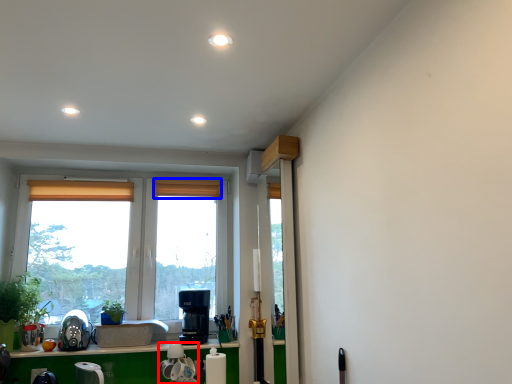
Question: Which point is closer to the camera, appliance (highlighted by a red box) or curtain (highlighted by a blue box)?

Choices:
 (A) appliance
 (B) curtain

Answer: (A)